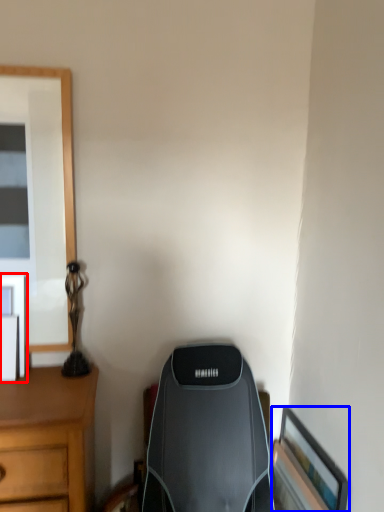
Question: Among these objects, which one is farthest to the camera, picture frame (highlighted by a red box) or picture frame (highlighted by a blue box)?

Choices:
 (A) picture frame
 (B) picture frame

Answer: (A)